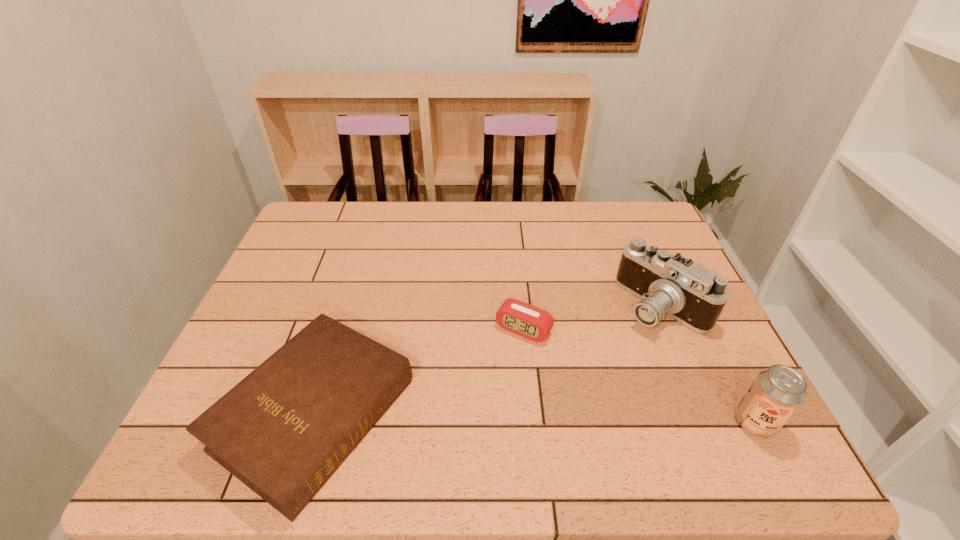
I want to click on vacant space on the desktop that is between the leftmost object and the beer can and is positioned on the front-facing side of the shortest object, so click(x=468, y=417).

I want to click on vacant spot on the desktop that is between the leftmost object and the beer can and is positioned at the lens of the camera, so click(x=474, y=417).